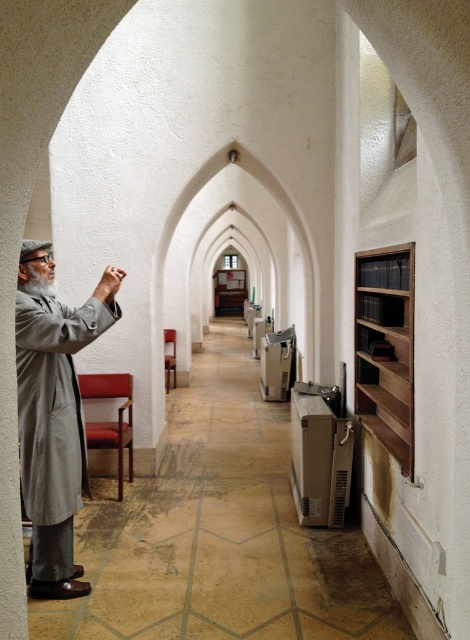
Question: Can you confirm if light gray woolen robe at left is smaller than dark brown wooden bookshelf at right?

Choices:
 (A) no
 (B) yes

Answer: (A)

Question: Where is light gray woolen robe at left located in relation to dark brown wooden bookshelf at right in the image?

Choices:
 (A) right
 (B) left

Answer: (B)

Question: Among these objects, which one is farthest from the camera?

Choices:
 (A) dark brown wooden bookshelf at right
 (B) light gray woolen robe at left

Answer: (A)

Question: Is light gray woolen robe at left to the right of dark brown wooden bookshelf at right from the viewer's perspective?

Choices:
 (A) no
 (B) yes

Answer: (A)